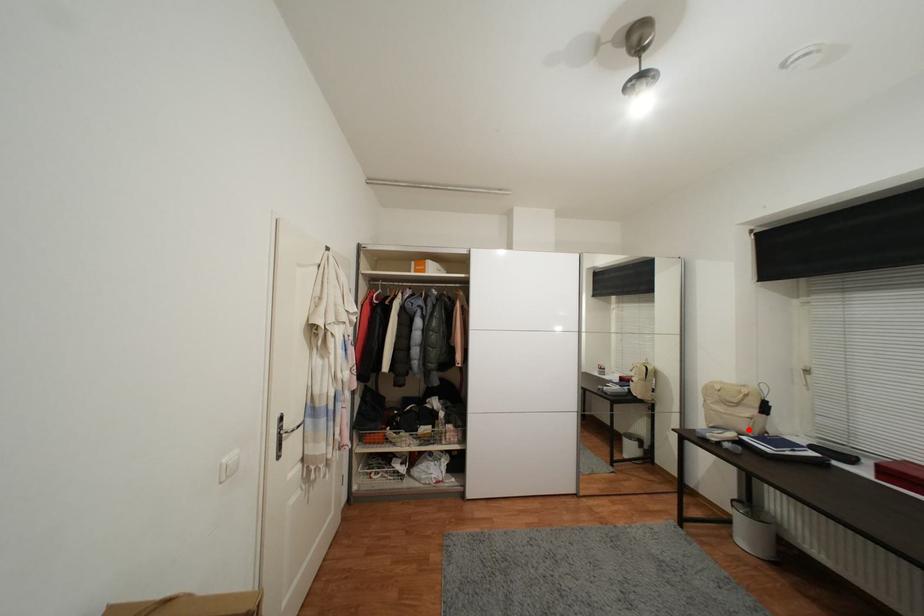
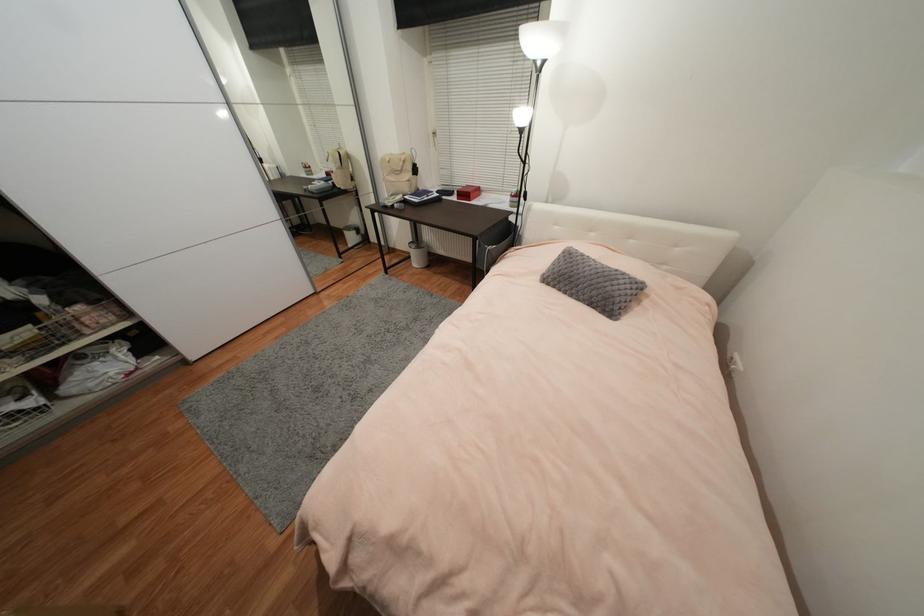
Question: I am providing you with two images of the same scene from different viewpoints. A red point is shown in image1. For the corresponding object point in image2, is it positioned nearer or farther from the camera?

Choices:
 (A) Nearer
 (B) Farther

Answer: (A)